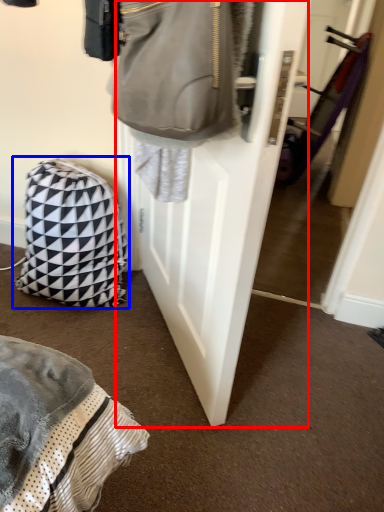
Question: Among these objects, which one is farthest to the camera, door (highlighted by a red box) or backpack (highlighted by a blue box)?

Choices:
 (A) door
 (B) backpack

Answer: (B)